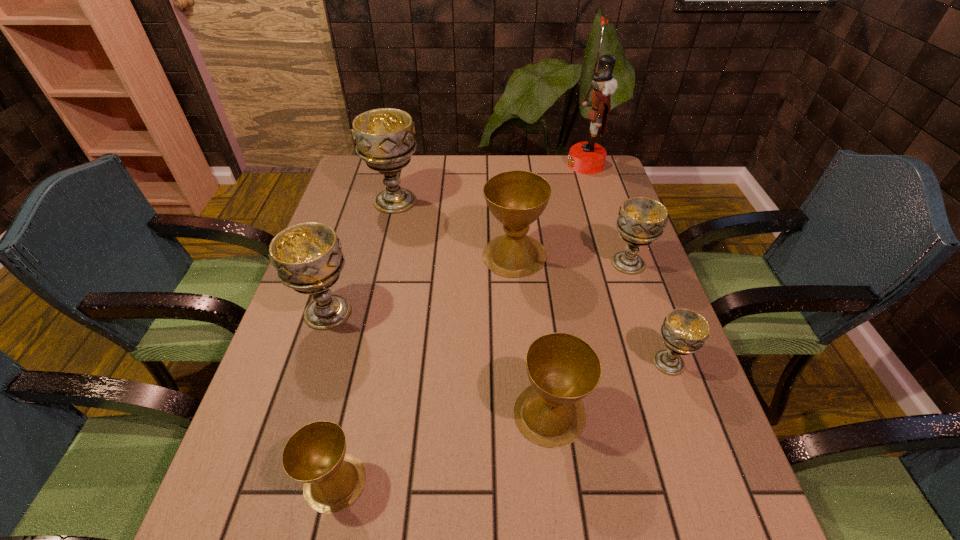
Locate an element on the screen. nutcracker is located at coordinates (589, 157).

Identify the location of the tallest object. (589, 157).

Image resolution: width=960 pixels, height=540 pixels. I want to click on the farthest chalice, so click(x=384, y=137).

Where is `the farthest white chalice`? Image resolution: width=960 pixels, height=540 pixels. the farthest white chalice is located at coordinates (384, 137).

Locate an element on the screen. The image size is (960, 540). the farthest brown chalice is located at coordinates (516, 198).

Image resolution: width=960 pixels, height=540 pixels. Identify the location of the fourth nearest object. (307, 256).

Locate an element on the screen. The height and width of the screenshot is (540, 960). the second nearest white chalice is located at coordinates (307, 256).

Image resolution: width=960 pixels, height=540 pixels. I want to click on the second nearest brown chalice, so click(x=562, y=368).

I want to click on the second nearest chalice, so click(562, 368).

Identify the location of the third biggest white chalice. This screenshot has width=960, height=540. (641, 220).